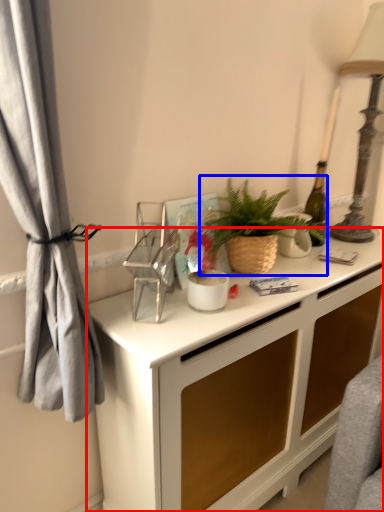
Question: Among these objects, which one is nearest to the camera, desk (highlighted by a red box) or houseplant (highlighted by a blue box)?

Choices:
 (A) desk
 (B) houseplant

Answer: (A)